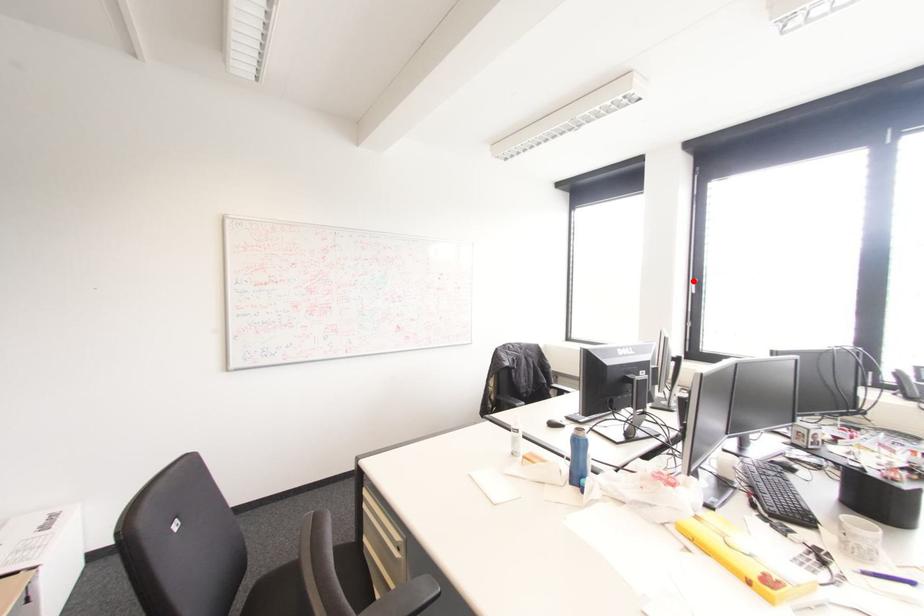
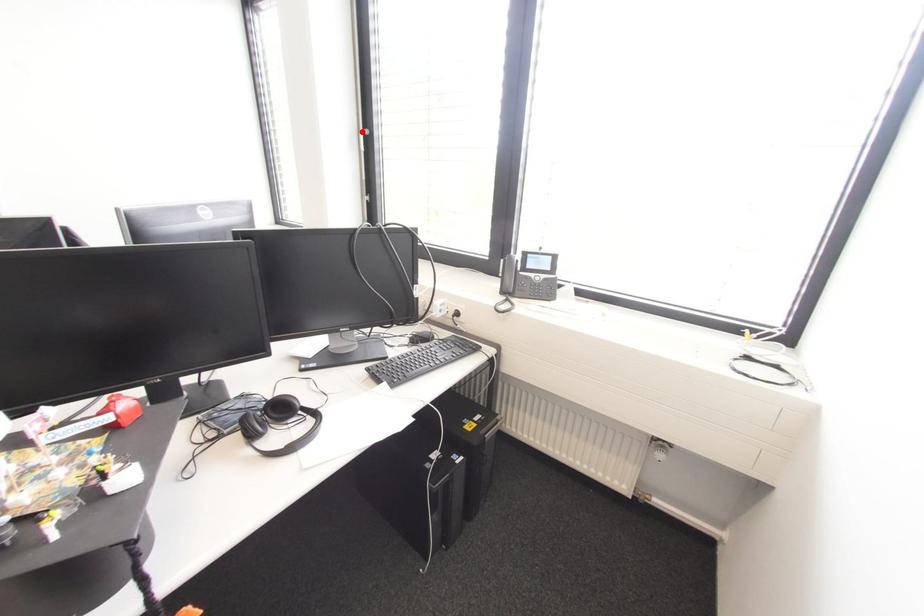
I am providing you with two images of the same scene from different viewpoints. A red point is marked on the first image and another point is marked on the second image. Is the marked point in image1 the same physical position as the marked point in image2?

Yes